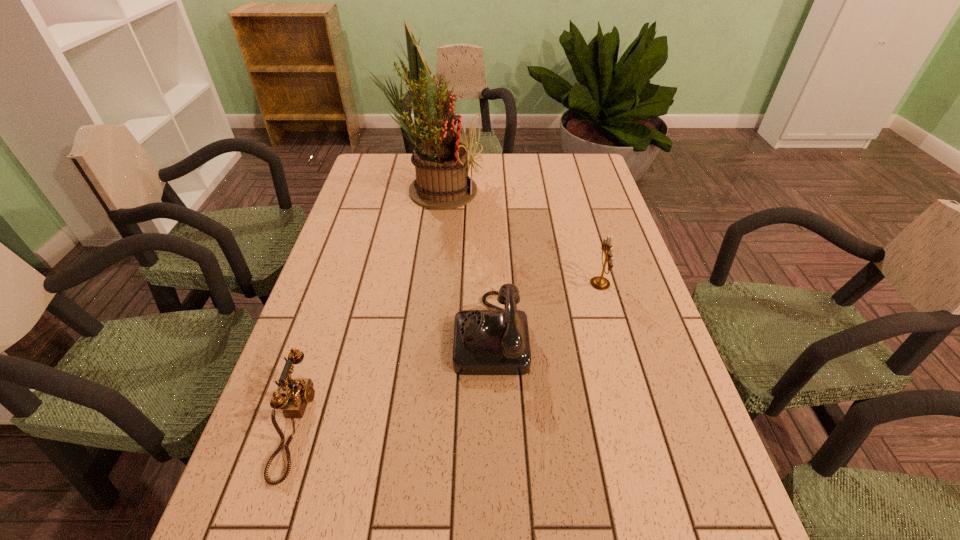
This screenshot has width=960, height=540. I want to click on the farthest object, so click(x=441, y=162).

Identify the location of the tallest object. coord(441,162).

This screenshot has width=960, height=540. What are the coordinates of `the rightmost object` in the screenshot? It's located at (599, 282).

In order to click on the second tallest object in this screenshot , I will do `click(599, 282)`.

Locate an element on the screen. This screenshot has height=540, width=960. the right telephone is located at coordinates 486,342.

At what (x,y) coordinates should I click in order to perform the action: click on the shortest object. Please return your answer as a coordinate pair (x, y). This screenshot has width=960, height=540. Looking at the image, I should click on (300, 392).

Where is `the shorter telephone`? Image resolution: width=960 pixels, height=540 pixels. the shorter telephone is located at coordinates (300, 392).

Where is `vacant space located 0.290m in front of the flower arrangement with the fan visible`? This screenshot has width=960, height=540. vacant space located 0.290m in front of the flower arrangement with the fan visible is located at coordinates (568, 190).

The height and width of the screenshot is (540, 960). Find the location of `free region located 0.320m on the left of the rightmost object`. free region located 0.320m on the left of the rightmost object is located at coordinates (468, 284).

Find the location of a particular element. Image resolution: width=960 pixels, height=540 pixels. vacant space located on the dial of the right telephone is located at coordinates (399, 333).